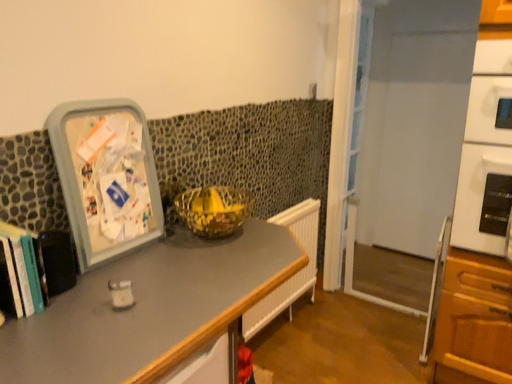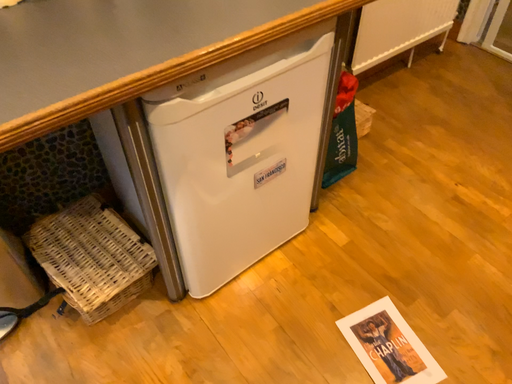
Question: Which way did the camera rotate in the video?

Choices:
 (A) rotated downward
 (B) rotated upward

Answer: (A)